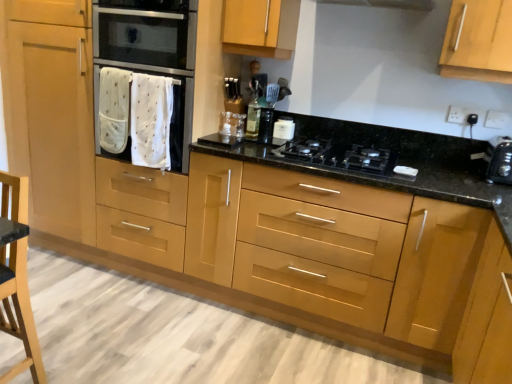
You are a GUI agent. You are given a task and a screenshot of the screen. Output one action in this format:
    pyautogui.click(x=<x>, y=<y>)
    Task: Click on the white fabric oven at left
    
    Given the screenshot: What is the action you would take?
    pyautogui.click(x=151, y=55)

Find the location of a particular element. The height and width of the screenshot is (384, 512). translucent glass bottle at center is located at coordinates (253, 115).

Where is `black glass gas stove at center`? This screenshot has width=512, height=384. black glass gas stove at center is located at coordinates (337, 156).

I want to click on white fabric oven at left, so click(151, 55).

Does point (252, 124) appear closer or farther from the camera than point (351, 144)?

Point (252, 124) appears to be farther away from the viewer than point (351, 144).

Considering the sizes of objects translucent glass bottle at center and black glass gas stove at center in the image provided, who is wider, translucent glass bottle at center or black glass gas stove at center?

With larger width is black glass gas stove at center.

Find the location of a particular element. This screenshot has width=512, height=384. gas stove on the right of translucent glass bottle at center is located at coordinates (337, 156).

How far apart are white fabric oven at left and black plastic toaster at right?

They are 5.49 feet apart.

Between white fabric oven at left and black plastic toaster at right, which one appears on the left side from the viewer's perspective?

white fabric oven at left is more to the left.

Considering the positions of objects white fabric oven at left and black plastic toaster at right in the image provided, who is in front, white fabric oven at left or black plastic toaster at right?

black plastic toaster at right is closer to the camera.

Does point (172, 6) appear closer or farther from the camera than point (511, 158)?

Point (172, 6) appears to be farther away from the viewer than point (511, 158).

Is glossy wood drawers at center looking in the opposite direction of translucent glass bottle at center?

No, glossy wood drawers at center is not facing away from translucent glass bottle at center.

Would you say glossy wood drawers at center is inside or outside translucent glass bottle at center?

glossy wood drawers at center exists outside the volume of translucent glass bottle at center.

From a real-world perspective, is glossy wood drawers at center physically located above or below translucent glass bottle at center?

In terms of real-world spatial position, glossy wood drawers at center is below translucent glass bottle at center.

Considering the points (463, 225) and (251, 103), which point is behind, point (463, 225) or point (251, 103)?

Positioned behind is point (251, 103).

Does translucent glass bottle at center have a lesser height compared to black plastic toaster at right?

In fact, translucent glass bottle at center may be taller than black plastic toaster at right.

Would you say translucent glass bottle at center is outside black plastic toaster at right?

Indeed, translucent glass bottle at center is completely outside black plastic toaster at right.

From a real-world perspective, which is physically below, translucent glass bottle at center or black plastic toaster at right?

From a 3D spatial view, black plastic toaster at right is below.

In the scene shown: Is black plastic toaster at right not within white glossy container at upper center?

black plastic toaster at right lies outside white glossy container at upper center's area.

What's the angular difference between black plastic toaster at right and white glossy container at upper center's facing directions?

The facing directions of black plastic toaster at right and white glossy container at upper center are 0.0466 degrees apart.

Which object is wider, black plastic toaster at right or white glossy container at upper center?

With larger width is black plastic toaster at right.

Visually, is black plastic toaster at right positioned to the left or to the right of white glossy container at upper center?

A: In the image, black plastic toaster at right appears on the right side of white glossy container at upper center.

Does black glass gas stove at center lie in front of stainless steel oven at center?

Yes, black glass gas stove at center is closer to the camera.

Is black glass gas stove at center in contact with stainless steel oven at center?

No, black glass gas stove at center is not with stainless steel oven at center.

Is point (352, 165) positioned in front of point (113, 36)?

Yes.

From a real-world perspective, is black glass gas stove at center located higher than stainless steel oven at center?

Actually, black glass gas stove at center is physically below stainless steel oven at center in the real world.

Is black plastic toaster at right smaller than stainless steel oven at center?

Indeed, black plastic toaster at right has a smaller size compared to stainless steel oven at center.

Which of these two, black plastic toaster at right or stainless steel oven at center, is thinner?

Thinner between the two is black plastic toaster at right.

Consider the image. Between black plastic toaster at right and stainless steel oven at center, which one has more height?

Standing taller between the two is stainless steel oven at center.

I want to click on bottle on the left of black glass gas stove at center, so click(x=253, y=115).

Locate an element on the screen. Image resolution: width=512 pixels, height=384 pixels. oven directly beneath the black plastic toaster at right (from a real-world perspective) is located at coordinates (151, 55).

Considering their positions, is white glossy container at upper center positioned closer to wooden armchair at lower left than stainless steel oven at center?

stainless steel oven at center is closer to wooden armchair at lower left.

Looking at the image, which one is located closer to black glass gas stove at center, white fabric oven at left or glossy wood drawers at center?

glossy wood drawers at center lies closer to black glass gas stove at center than the other object.

From the picture: Estimate the real-world distances between objects in this image. Which object is further from white fabric oven at left, glossy wood drawers at center or wooden armchair at lower left?

wooden armchair at lower left is further to white fabric oven at left.

Estimate the real-world distances between objects in this image. Which object is further from white fabric oven at left, translucent glass bottle at center or white glossy container at upper center?

white glossy container at upper center is further to white fabric oven at left.

Looking at this image, which object lies nearer to the anchor point black plastic toaster at right, white glossy container at upper center or stainless steel oven at center?

white glossy container at upper center lies closer to black plastic toaster at right than the other object.

Based on their spatial positions, is white glossy container at upper center or stainless steel oven at center closer to glossy wood drawers at center?

white glossy container at upper center is positioned closer to the anchor glossy wood drawers at center.

Based on their spatial positions, is wooden armchair at lower left or translucent glass bottle at center further from white fabric oven at left?

The object further to white fabric oven at left is wooden armchair at lower left.

Estimate the real-world distances between objects in this image. Which object is further from black plastic toaster at right, stainless steel oven at center or glossy wood drawers at center?

The object further to black plastic toaster at right is stainless steel oven at center.

Where is `oven between wooden armchair at lower left and glossy wood drawers at center`? oven between wooden armchair at lower left and glossy wood drawers at center is located at coordinates (151, 55).

Locate an element on the screen. The width and height of the screenshot is (512, 384). gas stove between wooden armchair at lower left and black plastic toaster at right in the horizontal direction is located at coordinates (337, 156).

The height and width of the screenshot is (384, 512). What are the coordinates of `home appliance located between white fabric oven at left and white glossy container at upper center in the left-right direction` in the screenshot? It's located at (146, 33).

I want to click on bottle situated between wooden armchair at lower left and black plastic toaster at right from left to right, so click(x=253, y=115).